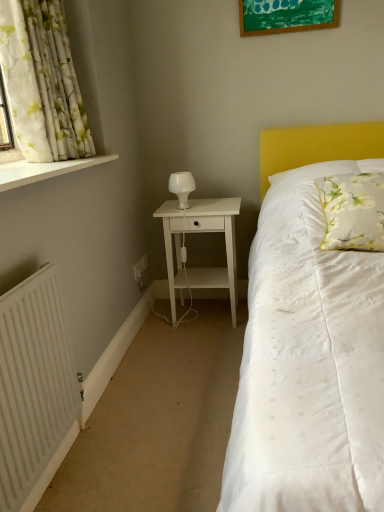
At what (x,y) coordinates should I click in order to perform the action: click on vacant space underneath white ribbed radiator at lower left (from a real-world perspective). Please return your answer as a coordinate pair (x, y). Looking at the image, I should click on (68, 469).